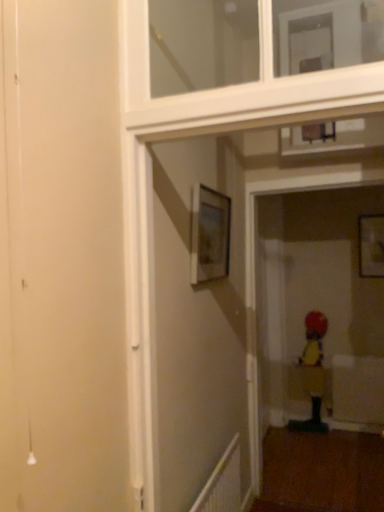
Question: Considering the positions of matte wooden picture frame at upper right, the 2th picture frame in the left-to-right sequence, and white glossy window frame at upper center in the image, is matte wooden picture frame at upper right, the 2th picture frame in the left-to-right sequence, wider or thinner than white glossy window frame at upper center?

Choices:
 (A) wide
 (B) thin

Answer: (B)

Question: Is matte wooden picture frame at upper right, the 2th picture frame in the left-to-right sequence, taller or shorter than white glossy window frame at upper center?

Choices:
 (A) tall
 (B) short

Answer: (A)

Question: Which is farther from the matte wooden picture frame at upper right, placed as the 1th picture frame when sorted from right to left?

Choices:
 (A) white plastic radiator at lower right
 (B) yellow fabric child at lower right
 (C) matte wooden picture frame at upper center, the 2th picture frame when ordered from right to left
 (D) white glossy window frame at upper center

Answer: (D)

Question: Which of these objects is positioned closest to the white plastic radiator at lower right?

Choices:
 (A) matte wooden picture frame at upper center, which is the first picture frame in front-to-back order
 (B) yellow fabric child at lower right
 (C) white glossy window frame at upper center
 (D) matte wooden picture frame at upper right, placed as the 1th picture frame when sorted from right to left

Answer: (A)